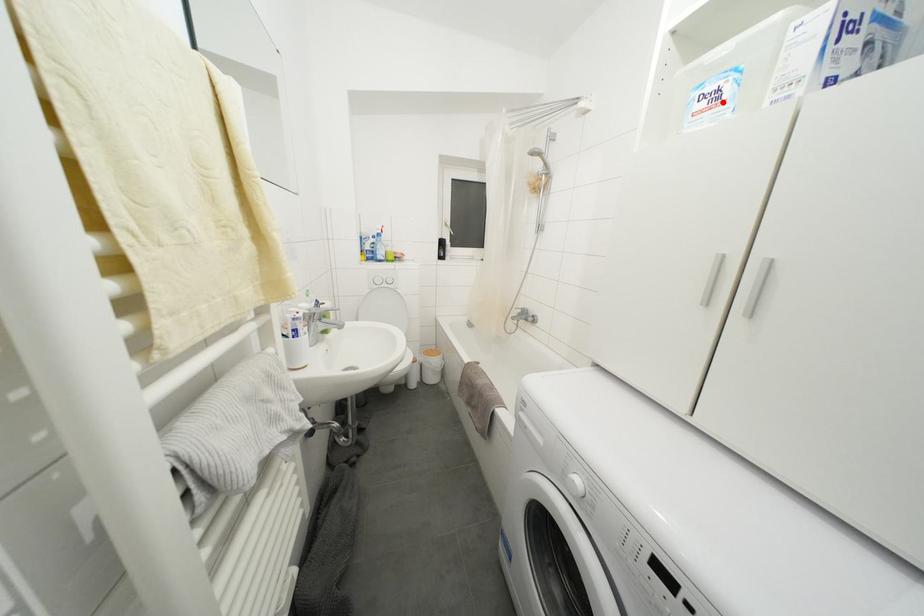
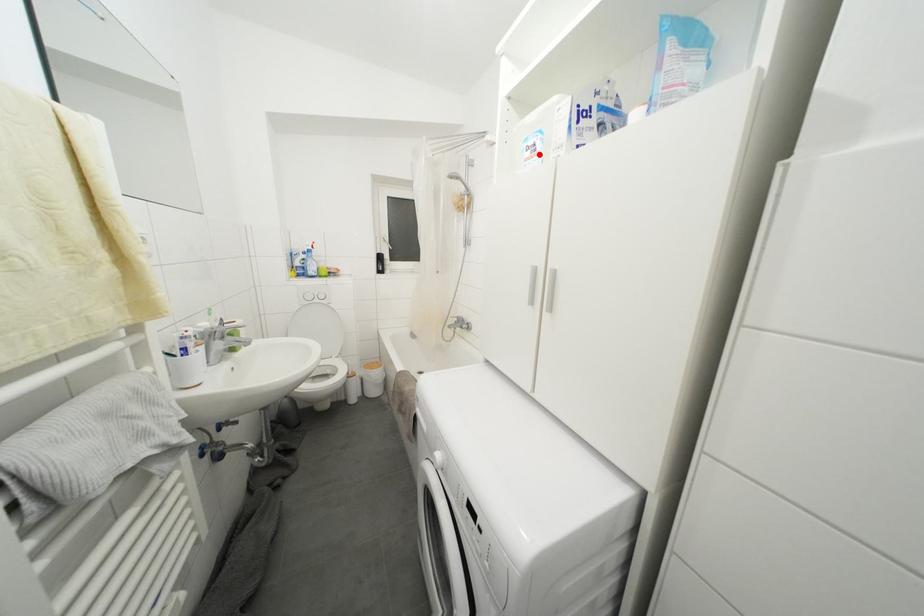
I am providing you with two images of the same scene from different viewpoints. A red point is marked on the first image and another point is marked on the second image. Does the point marked in image1 correspond to the same location as the one in image2?

Yes